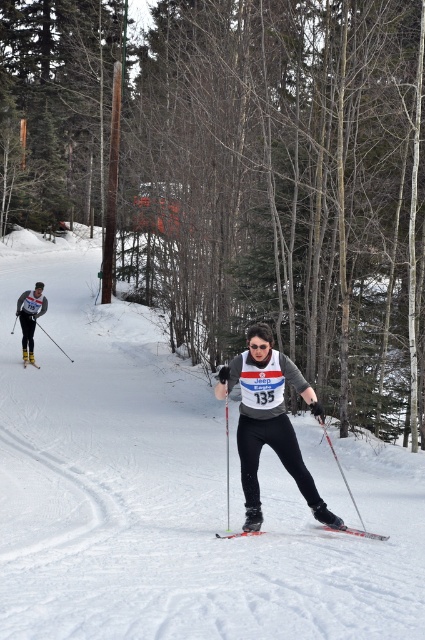
Based on the scene description, which object is shorter between the metallic silver ski at center and the matte black ski pole at left?

The metallic silver ski at center is shorter than the matte black ski pole at left.

You are a photographer trying to capture a clear shot of both the metallic silver ski at center and the matte black ski pole at left. Based on their positions, which object should you focus on first to ensure both are in frame?

The metallic silver ski at center is located below the matte black ski pole at left, so you should focus on the matte black ski pole at left first to ensure both are in frame.